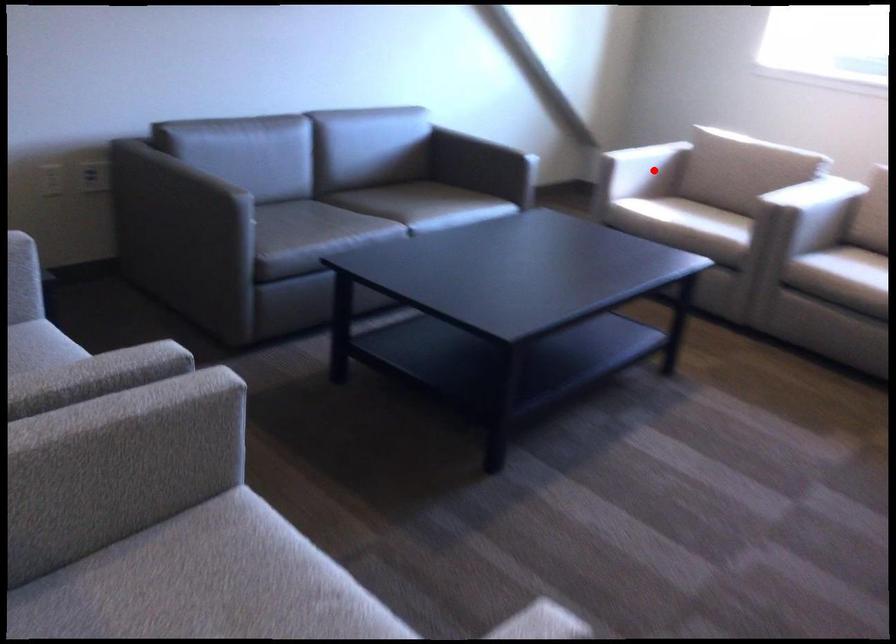
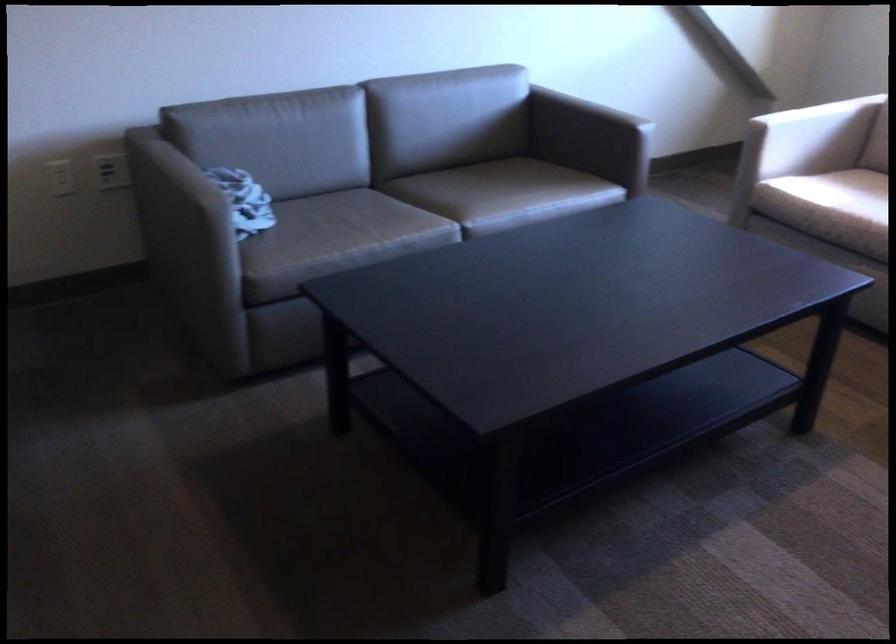
Question: I am providing you with two images of the same scene from different viewpoints. Image1 has a red point marked. In image2, the corresponding 3D location appears at what relative position? Reply with the corresponding letter.

Choices:
 (A) Closer
 (B) Farther

Answer: (A)